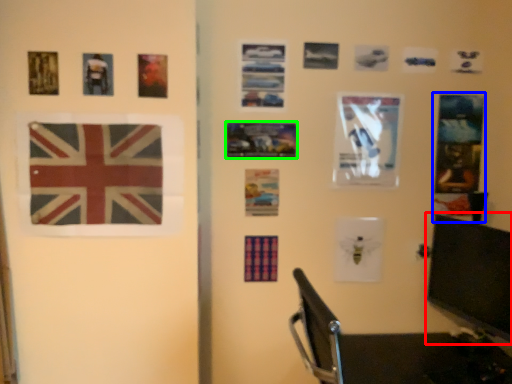
Question: Based on their relative distances, which object is farther from computer monitor (highlighted by a red box)? Choose from postcard (highlighted by a blue box) and picture frame (highlighted by a green box).

Choices:
 (A) postcard
 (B) picture frame

Answer: (B)